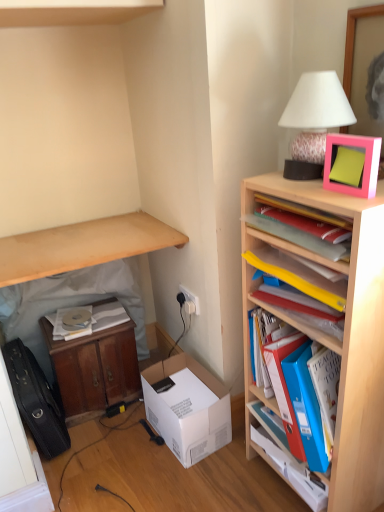
The height and width of the screenshot is (512, 384). Identify the location of vacant space positioned to the left of wooden bookshelf at right, acting as the second shelf starting from the bottom. (233, 484).